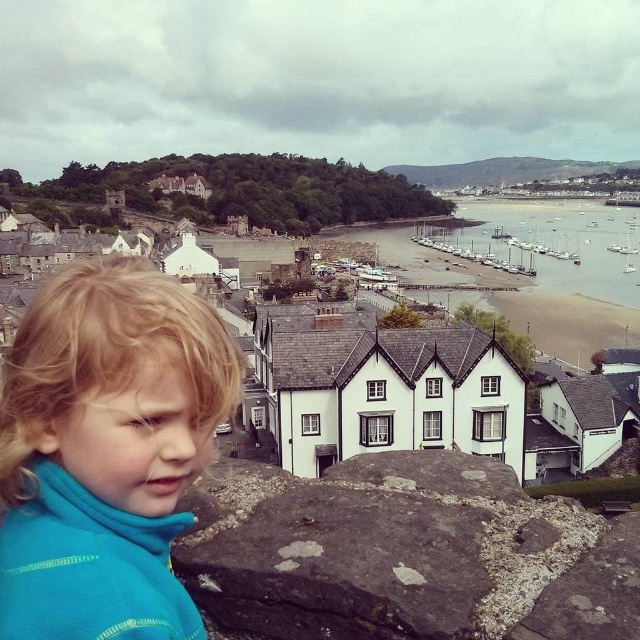
You are standing at the elevated vantage point overlooking the coastal town. There is a specific point marked at coordinates point (291,604). Can you determine if this point is closer to you or farther away than 40 meters?

The distance between point (291,604) and the viewer is 39.00 meters, which is less than 40 meters. Therefore, the point is closer to you than 40 meters.

You are standing at the elevated vantage point in the coastal town scene. You notice two points marked in the image. The first is at coordinate point (96,458) and the second is at coordinate point (518,234). Which of these two points is nearer to your current position?

Point (96,458) is closer to the camera than point (518,234), so the first point is nearer to your current position.